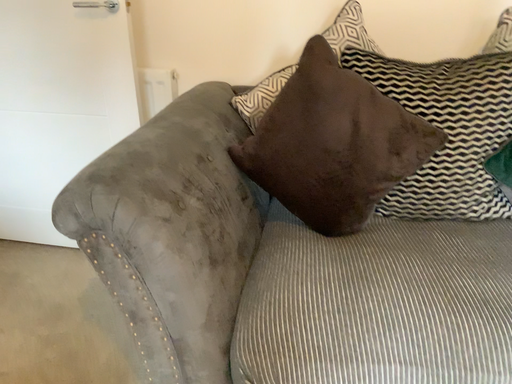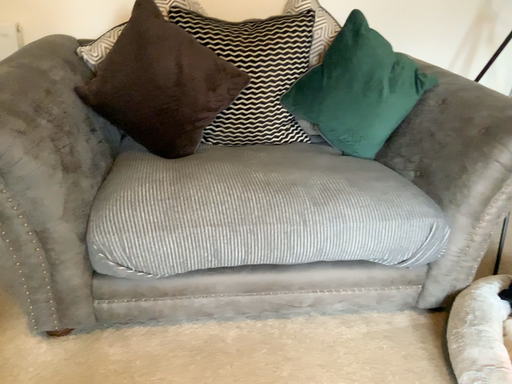
Question: Which way did the camera rotate in the video?

Choices:
 (A) rotated right
 (B) rotated left

Answer: (A)